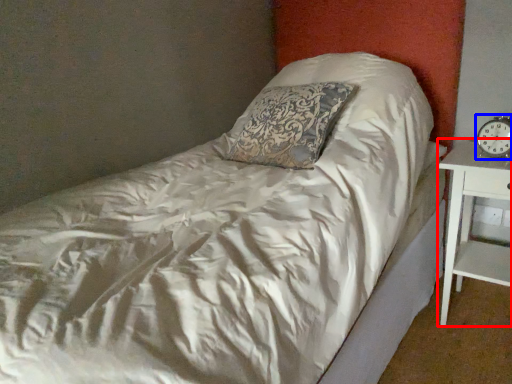
Question: Among these objects, which one is farthest to the camera, nightstand (highlighted by a red box) or clock (highlighted by a blue box)?

Choices:
 (A) nightstand
 (B) clock

Answer: (B)